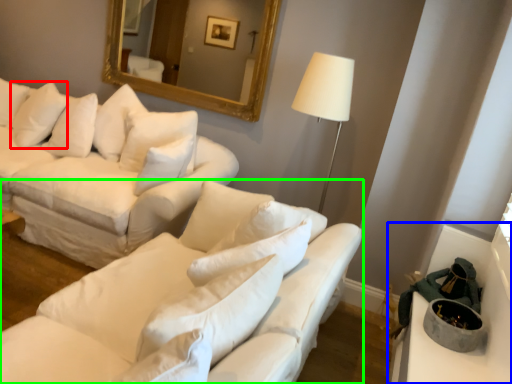
Question: Considering the real-world distances, which object is closest to pillow (highlighted by a red box)? table (highlighted by a blue box) or studio couch (highlighted by a green box).

Choices:
 (A) table
 (B) studio couch

Answer: (B)